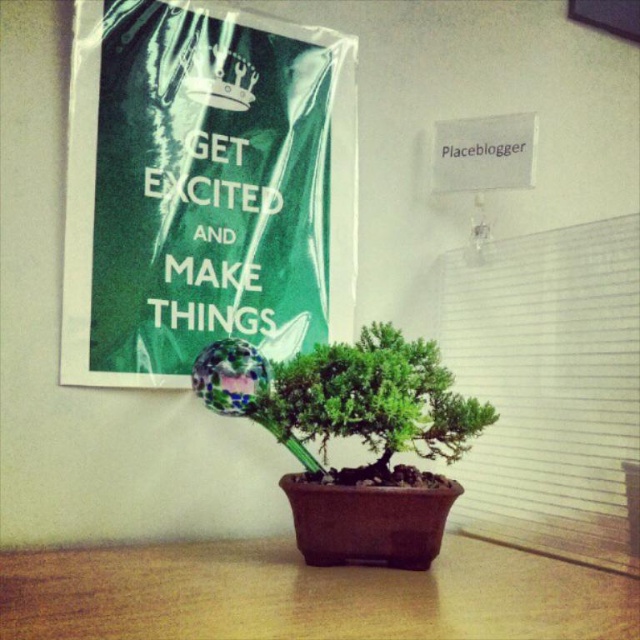
How distant is brown wood table at center from green glossy bonsai tree at center?

The distance of brown wood table at center from green glossy bonsai tree at center is 7.48 inches.

Which of these two, brown wood table at center or green glossy bonsai tree at center, stands taller?

green glossy bonsai tree at center

The image size is (640, 640). Find the location of `brown wood table at center`. brown wood table at center is located at coordinates (305, 595).

Where is `brown wood table at center`? brown wood table at center is located at coordinates (305, 595).